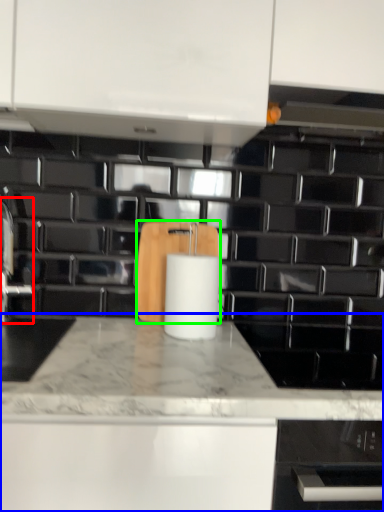
Question: Which object is positioned closest to faucet (highlighted by a red box)? Select from countertop (highlighted by a blue box) and cutting board (highlighted by a green box).

Choices:
 (A) countertop
 (B) cutting board

Answer: (B)